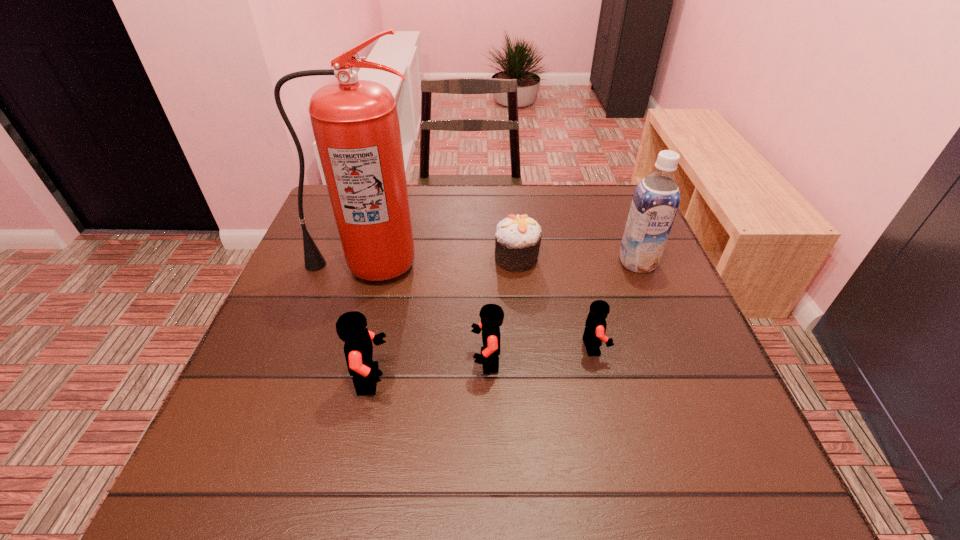
Identify the location of free spot that satisfies the following two spatial constraints: 1. on the label of the rightmost object; 2. on the front-facing side of the leftmost Lego. This screenshot has width=960, height=540. (684, 379).